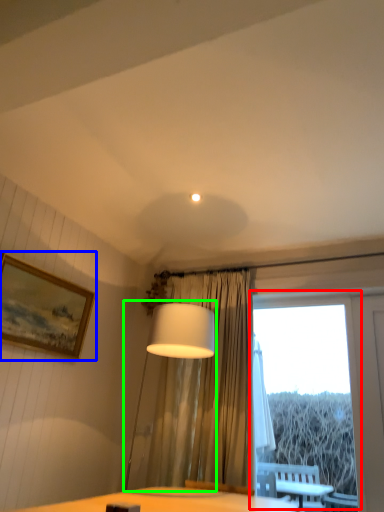
Question: Estimate the real-world distances between objects in this image. Which object is farther from window (highlighted by a red box), picture frame (highlighted by a blue box) or table lamp (highlighted by a green box)?

Choices:
 (A) picture frame
 (B) table lamp

Answer: (A)